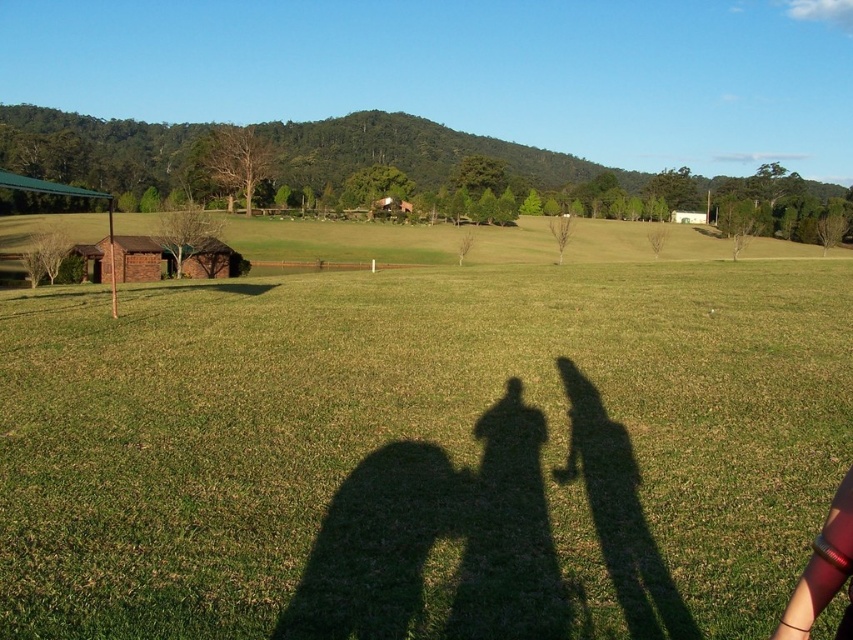
You are standing in the field and see the green grass at center and the red fabric arm at lower right. Which object is taller?

The green grass at center is taller than the red fabric arm at lower right.

You are standing at the origin point in the grassy field. You see two points marked as point 1 at coordinates point (805, 317) and point 2 at coordinates point (840, 584). If you want to walk towards point 2 first before reaching point 1, which path should you take? Please describe the direction and distance relative to the points.

Since point 1 is behind point 2, you should walk towards point 2 first in the direction of its coordinates, then continue past it to reach point 1 which is further along the same path.